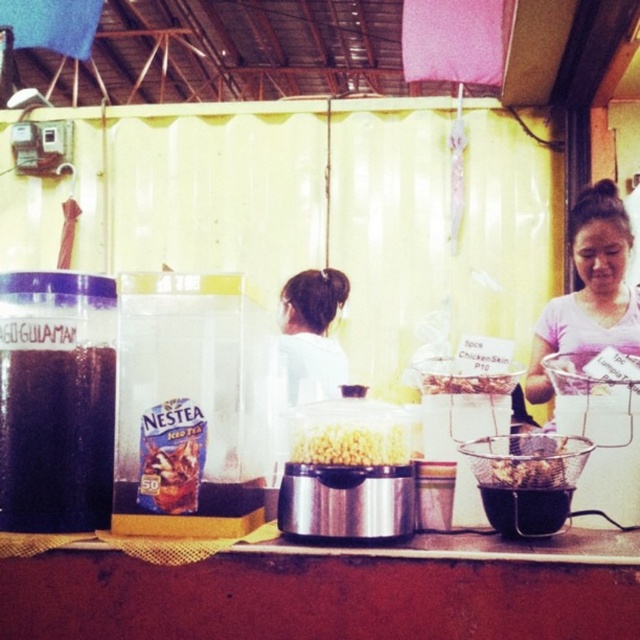
You are standing at the food stall and want to reach both the Nestea Iced Tea container and the popcorn machine. Which object is closer to you, the point at (337, 300) or the point at (396, 442)?

The point at (337, 300) is closer to you than the point at (396, 442).

You are a customer at the food stall and want to know which item is taller between the white fabric hair at center and the yellow matte popcorn at center. Can you tell me which one is taller?

The white fabric hair at center is taller than the yellow matte popcorn at center according to the description provided.